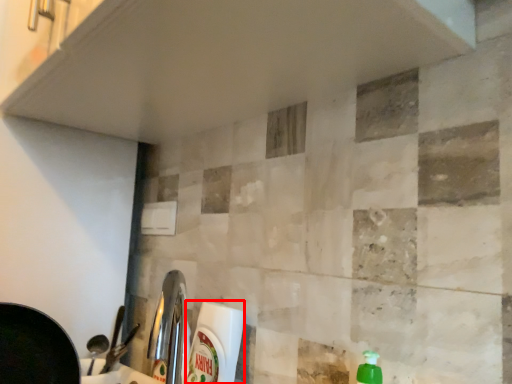
Question: From the image, what is the correct spatial relationship of cleaning product (annotated by the red box) in relation to counter top?

Choices:
 (A) right
 (B) left

Answer: (A)